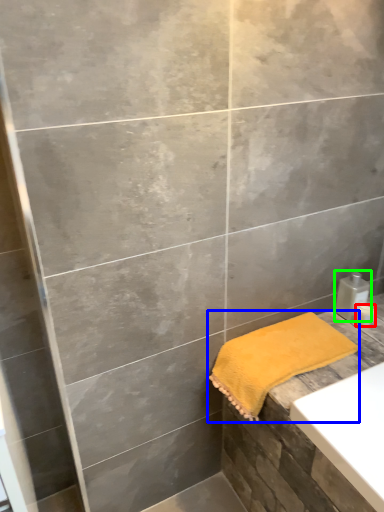
Question: Estimate the real-world distances between objects in this image. Which object is closer to toiletry (highlighted by a red box), towel (highlighted by a blue box) or soap dispenser (highlighted by a green box)?

Choices:
 (A) towel
 (B) soap dispenser

Answer: (B)